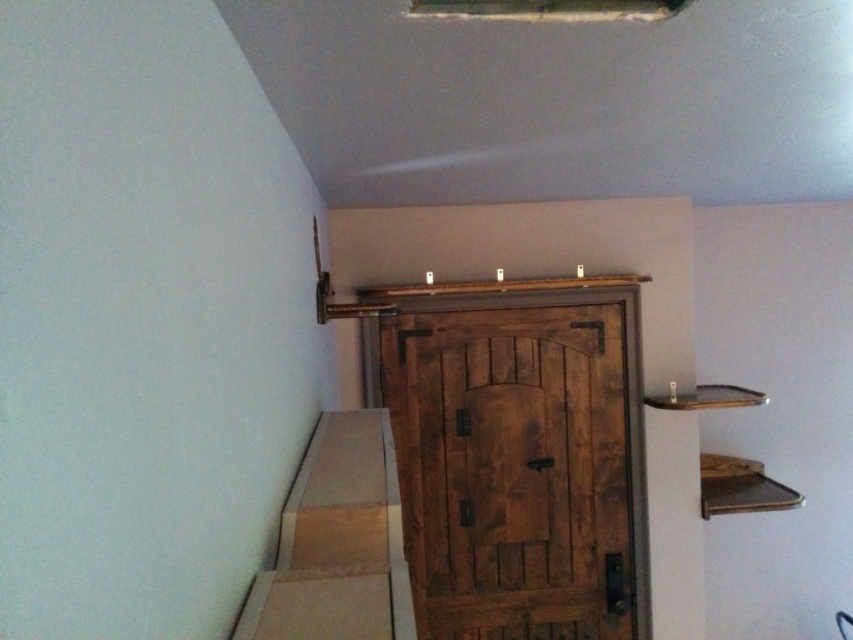
You are standing in the hallway and want to reach both points mentioned. Which point is closer to you, point (538, 593) or point (352, 524)?

Point (538, 593) is further to the viewer than point (352, 524), so point (352, 524) is closer to you.

You are standing in the hallway and want to go upstairs. The rustic wood door at center is closed. Can you see the wooden stairs at lower center from your current position?

The wooden stairs at lower center is behind rustic wood door at center, so if the door is closed, you cannot see the wooden stairs at lower center.

You are standing in the hallway and want to open the door. Where is the handle located relative to the point at coordinates (520, 468)?

The handle is on the right side of the rustic wood door at center, so it is to the right of the point at coordinates (520, 468).